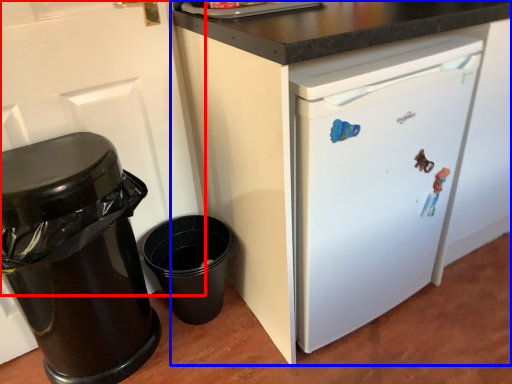
Question: Among these objects, which one is nearest to the camera, door (highlighted by a red box) or cabinetry (highlighted by a blue box)?

Choices:
 (A) door
 (B) cabinetry

Answer: (B)